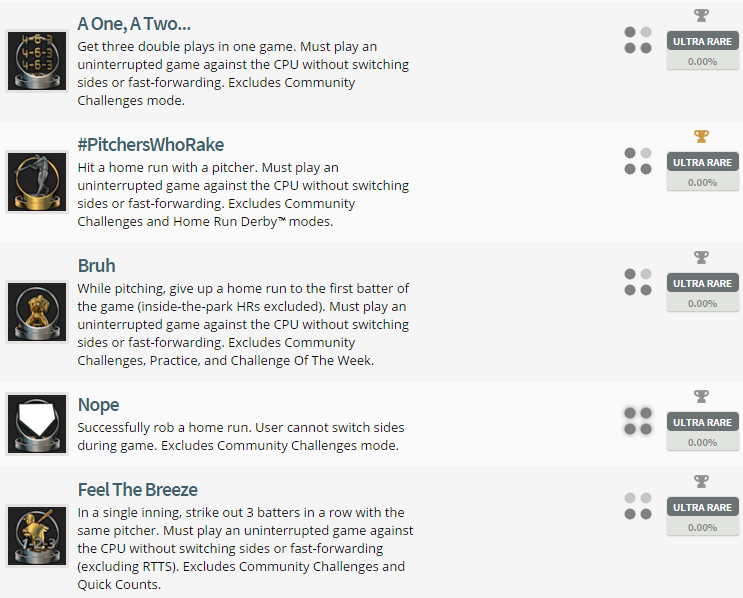
At what (x,y) coordinates should I click in order to perform the action: click on award. Please return your answer as a coordinate pair (x, y). Image resolution: width=743 pixels, height=598 pixels. Looking at the image, I should click on (50, 67), (44, 172), (30, 317), (42, 423), (36, 530).